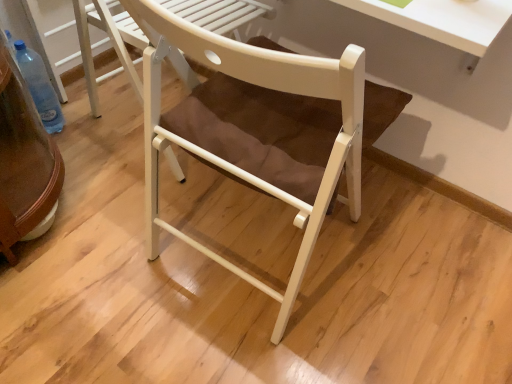
Find the location of a particular element. free space to the right of white wood chair at center, arranged as the 1th chair when viewed from the front is located at coordinates (409, 270).